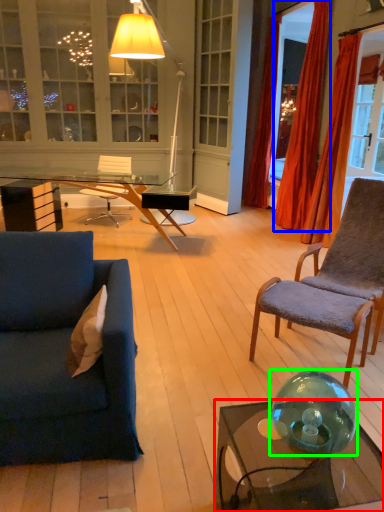
Question: Based on their relative distances, which object is farther from coffee table (highlighted by a red box)? Choose from curtain (highlighted by a blue box) and glass bowl (highlighted by a green box).

Choices:
 (A) curtain
 (B) glass bowl

Answer: (A)